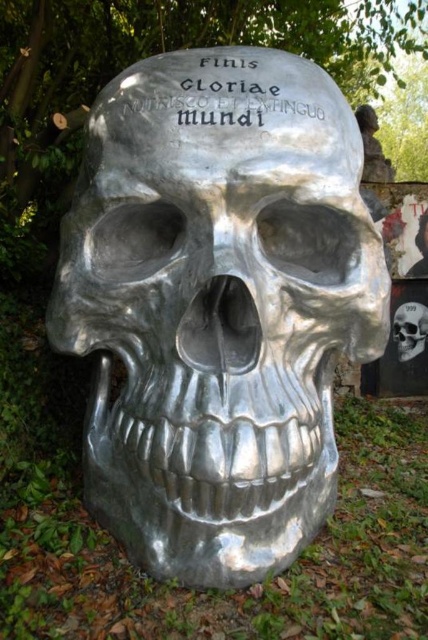
Question: Considering the real-world distances, which object is farthest from the shiny silver skull at center?

Choices:
 (A) metallic silver skull at center
 (B) shiny metallic skull at center

Answer: (B)

Question: Which object appears closest to the camera in this image?

Choices:
 (A) metallic silver skull at center
 (B) shiny silver skull at center

Answer: (A)

Question: Where is shiny silver skull at center located in relation to metallic silver skull at center in the image?

Choices:
 (A) below
 (B) above

Answer: (A)

Question: Can you confirm if shiny metallic skull at center is wider than metallic silver skull at center?

Choices:
 (A) no
 (B) yes

Answer: (B)

Question: Among these objects, which one is nearest to the camera?

Choices:
 (A) shiny metallic skull at center
 (B) shiny silver skull at center
 (C) metallic silver skull at center

Answer: (A)

Question: Is shiny metallic skull at center smaller than shiny silver skull at center?

Choices:
 (A) yes
 (B) no

Answer: (B)